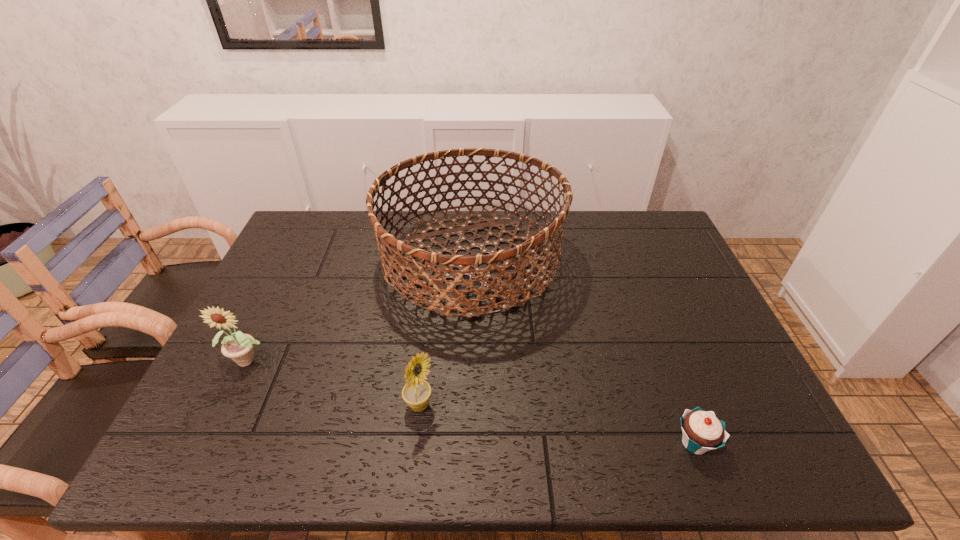
What are the coordinates of `vacant point located between the nearer sunflower and the farther sunflower` in the screenshot? It's located at (335, 382).

The width and height of the screenshot is (960, 540). In order to click on vacant space that's between the cupcake and the farther sunflower in this screenshot , I will do `click(472, 401)`.

Locate an element on the screen. This screenshot has height=540, width=960. vacant point located between the basket and the third tallest object is located at coordinates (445, 333).

You are a GUI agent. You are given a task and a screenshot of the screen. Output one action in this format:
    pyautogui.click(x=<x>, y=<y>)
    Task: Click on the object that is the third closest one to the cupcake
    
    Given the screenshot: What is the action you would take?
    coord(239,347)

I want to click on object that stands as the second closest to the third tallest object, so click(x=239, y=347).

This screenshot has width=960, height=540. Identify the location of free location that satisfies the following two spatial constraints: 1. on the face of the cupcake; 2. on the right side of the second nearest object. (416, 443).

At what (x,y) coordinates should I click in order to perform the action: click on blank space that satisfies the following two spatial constraints: 1. on the back side of the cupcake; 2. on the face of the second shortest object. Please return your answer as a coordinate pair (x, y). Image resolution: width=960 pixels, height=540 pixels. Looking at the image, I should click on (681, 406).